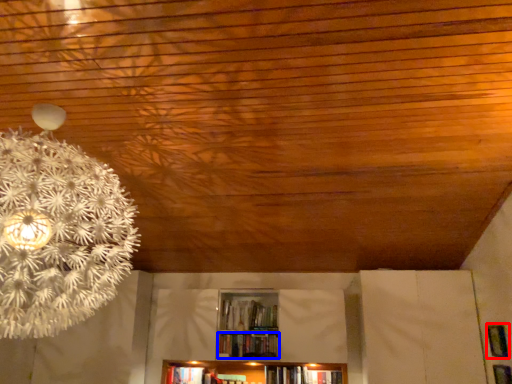
Question: Among these objects, which one is farthest to the camera, panel (highlighted by a red box) or book (highlighted by a blue box)?

Choices:
 (A) panel
 (B) book

Answer: (B)